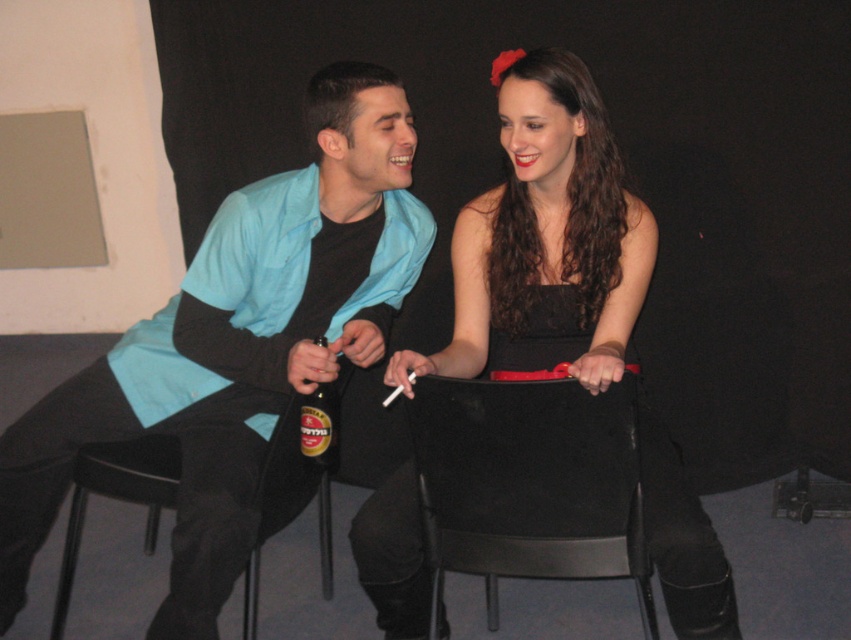
Who is shorter, matte blue shirt at left or black satin dress at center?

With less height is black satin dress at center.

Based on the photo, who is more distant from viewer, [252,324] or [395,372]?

Point [252,324]

At what (x,y) coordinates should I click in order to perform the action: click on matte blue shirt at left. Please return your answer as a coordinate pair (x, y). The height and width of the screenshot is (640, 851). Looking at the image, I should click on (237, 344).

Does point (311, 346) come in front of point (535, 520)?

No, (311, 346) is behind (535, 520).

Between point (393, 116) and point (437, 580), which one is positioned in front?

Point (437, 580) is in front.

The height and width of the screenshot is (640, 851). I want to click on matte blue shirt at left, so click(x=237, y=344).

Is black satin dress at center to the left of metallic gold beer bottle at center from the viewer's perspective?

Incorrect, black satin dress at center is not on the left side of metallic gold beer bottle at center.

Who is more distant from viewer, (591, 301) or (337, 406)?

The point (337, 406) is more distant.

Measure the distance between point (654, 490) and camera.

The distance of point (654, 490) from camera is 1.66 meters.

Where is `black satin dress at center`? Image resolution: width=851 pixels, height=640 pixels. black satin dress at center is located at coordinates (546, 240).